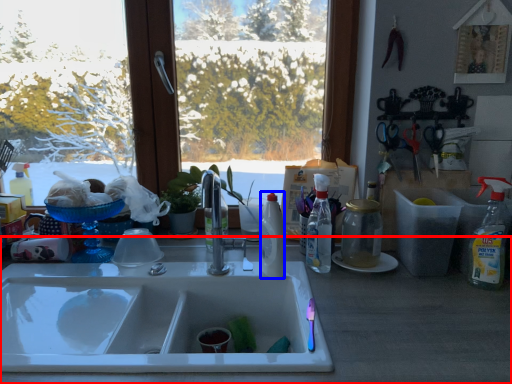
Question: Which object is closer to the camera taking this photo, counter top (highlighted by a red box) or bottle (highlighted by a blue box)?

Choices:
 (A) counter top
 (B) bottle

Answer: (A)